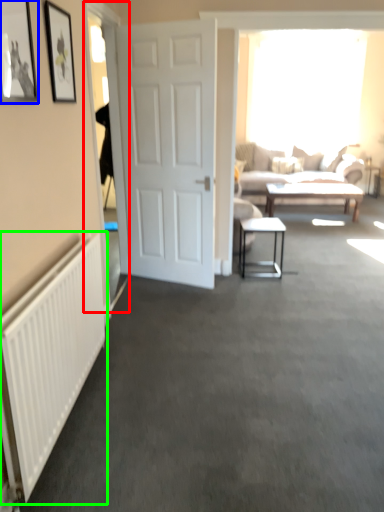
Question: Based on their relative distances, which object is nearer to glass door (highlighted by a red box)? Choose from picture frame (highlighted by a blue box) and radiator (highlighted by a green box).

Choices:
 (A) picture frame
 (B) radiator

Answer: (B)